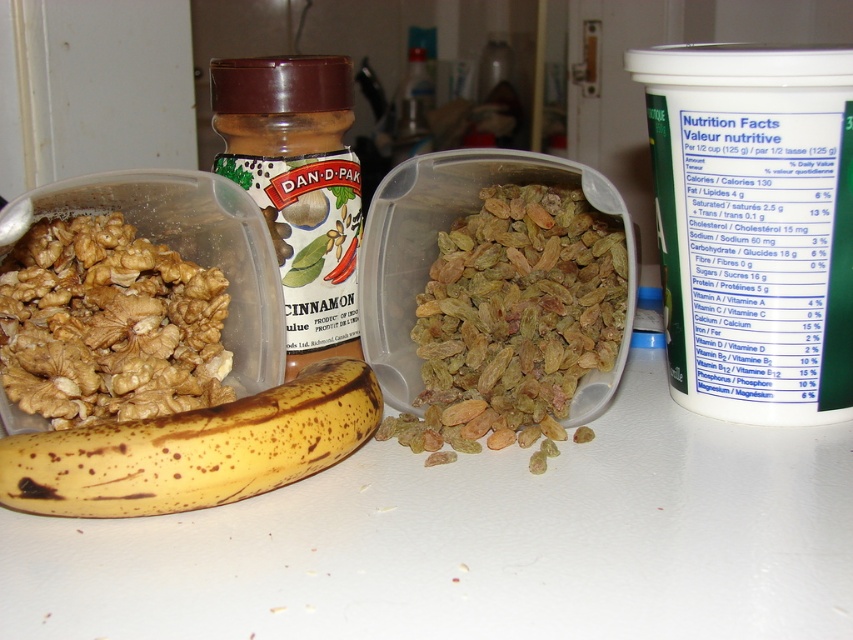
Who is positioned more to the left, light brown dried at center or brown textured walnut at left?

From the viewer's perspective, brown textured walnut at left appears more on the left side.

Does light brown dried at center appear over brown textured walnut at left?

Correct, light brown dried at center is located above brown textured walnut at left.

Does point (548, 339) come behind point (84, 353)?

That is True.

At what (x,y) coordinates should I click in order to perform the action: click on light brown dried at center. Please return your answer as a coordinate pair (x, y). The image size is (853, 640). Looking at the image, I should click on (514, 317).

Does brown textured walnut at left have a smaller size compared to yellow spotted banana at lower left?

No.

Which is in front, point (113, 412) or point (166, 444)?

Point (166, 444)

Locate an element on the screen. This screenshot has height=640, width=853. brown textured walnut at left is located at coordinates [x=108, y=324].

The height and width of the screenshot is (640, 853). In order to click on brown textured walnut at left in this screenshot , I will do `click(108, 324)`.

Does light brown dried at center have a larger size compared to yellow spotted banana at lower left?

Indeed, light brown dried at center has a larger size compared to yellow spotted banana at lower left.

Who is lower down, light brown dried at center or yellow spotted banana at lower left?

yellow spotted banana at lower left is below.

Find the location of a particular element. This screenshot has width=853, height=640. light brown dried at center is located at coordinates (514, 317).

Where is `light brown dried at center`? The height and width of the screenshot is (640, 853). light brown dried at center is located at coordinates (514, 317).